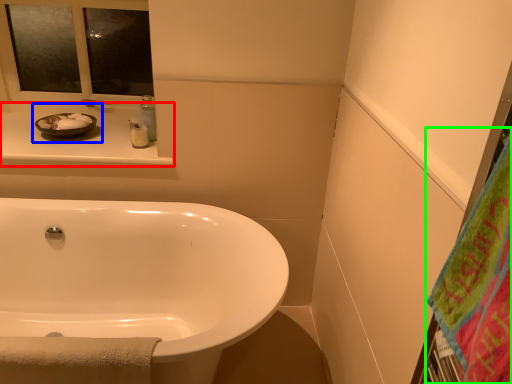
Question: Which object is the closest to the counter top (highlighted by a red box)? Choose among these: sink (highlighted by a blue box) or beach towel (highlighted by a green box).

Choices:
 (A) sink
 (B) beach towel

Answer: (A)